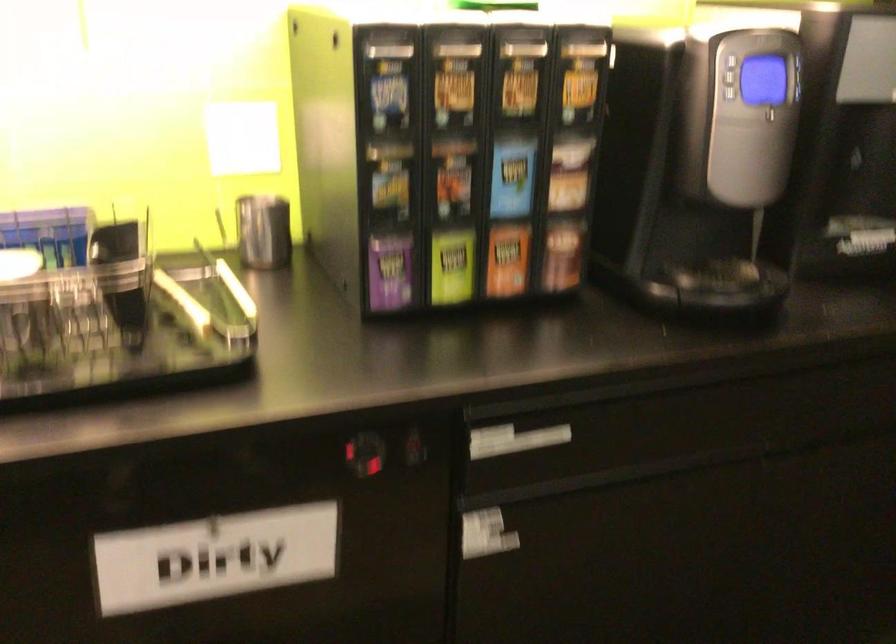
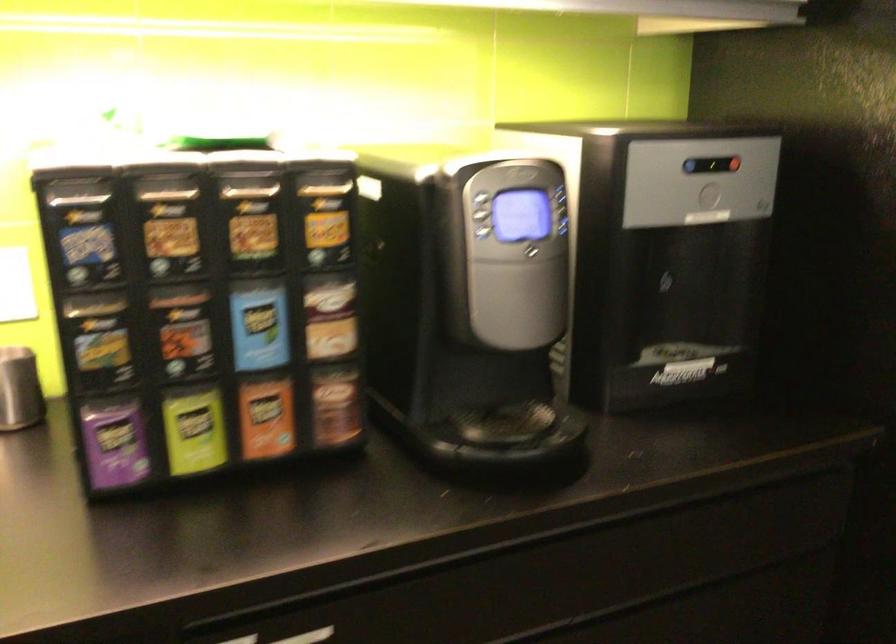
In the second image, find the point that corresponds to (555,438) in the first image.

(308, 636)